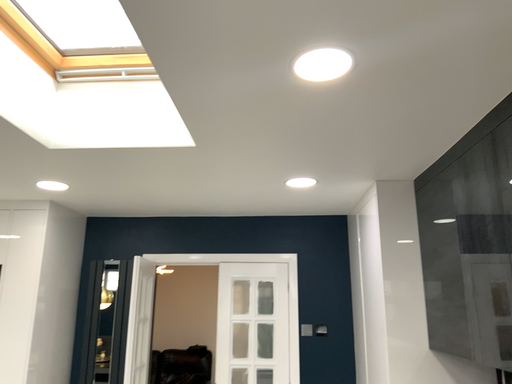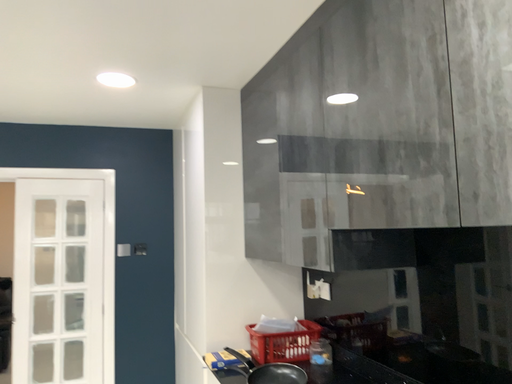
Question: How did the camera likely rotate when shooting the video?

Choices:
 (A) rotated downward
 (B) rotated upward

Answer: (A)